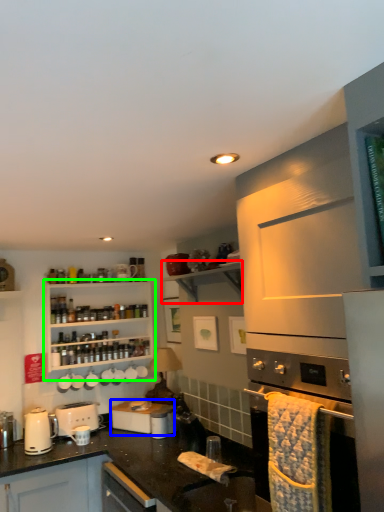
Question: Based on their relative distances, which object is farther from shelf (highlighted by a red box)? Choose from appliance (highlighted by a blue box) and cabinetry (highlighted by a green box).

Choices:
 (A) appliance
 (B) cabinetry

Answer: (A)